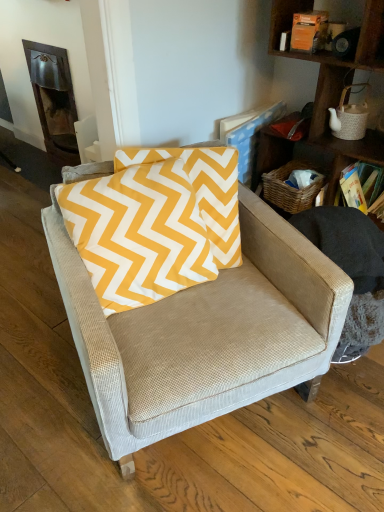
Question: Considering the positions of point (253, 214) and point (167, 242), is point (253, 214) closer or farther from the camera than point (167, 242)?

Choices:
 (A) farther
 (B) closer

Answer: (A)

Question: Considering the positions of beige fabric chair at center and yellow cotton pillow at center in the image, is beige fabric chair at center taller or shorter than yellow cotton pillow at center?

Choices:
 (A) tall
 (B) short

Answer: (A)

Question: Which is nearer to the hardcover book at upper right?

Choices:
 (A) dark wood fireplace at upper left
 (B) woven wood shelf at upper right
 (C) beige fabric chair at center
 (D) yellow cotton pillow at center

Answer: (B)

Question: Which object is positioned closest to the yellow cotton pillow at center?

Choices:
 (A) hardcover book at upper right
 (B) woven wood shelf at upper right
 (C) dark wood fireplace at upper left
 (D) beige fabric chair at center

Answer: (D)